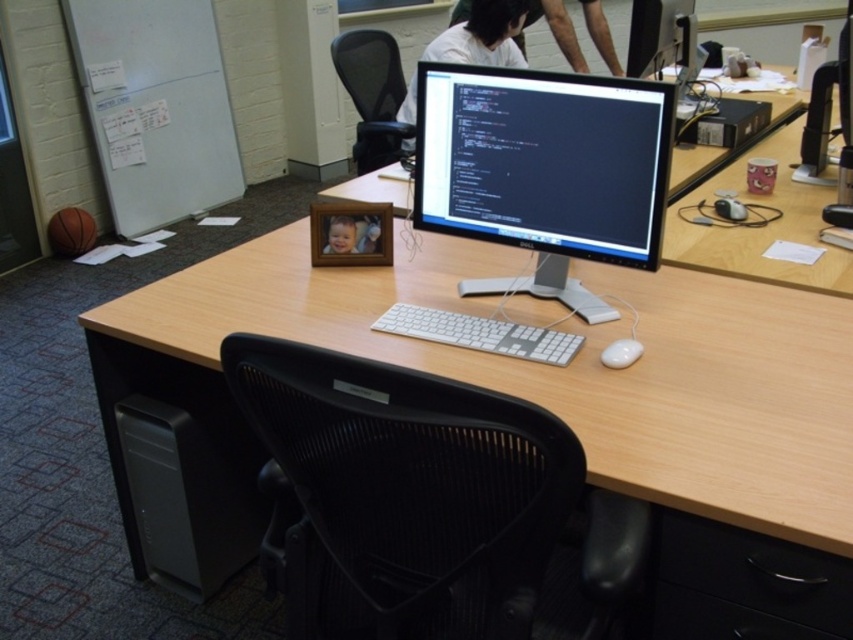
Does black plastic drawer at lower right appear under white matte shirt at upper center?

Correct, black plastic drawer at lower right is located below white matte shirt at upper center.

Who is more distant from viewer, [700,518] or [451,48]?

Point [451,48]

Identify the location of black plastic drawer at lower right. The image size is (853, 640). (746, 586).

Between black mesh swivel chair at center and black glossy monitor at center, which one appears on the left side from the viewer's perspective?

Positioned to the left is black mesh swivel chair at center.

Which is behind, point (340, 534) or point (666, 180)?

Positioned behind is point (666, 180).

Locate an element on the screen. The image size is (853, 640). black mesh swivel chair at center is located at coordinates (426, 502).

Can you confirm if black glossy monitor at center is wider than white plastic keyboard at center?

Indeed, black glossy monitor at center has a greater width compared to white plastic keyboard at center.

Who is more distant from viewer, (436, 186) or (392, 328)?

Positioned behind is point (436, 186).

Where is `black glossy monitor at center`? black glossy monitor at center is located at coordinates (543, 161).